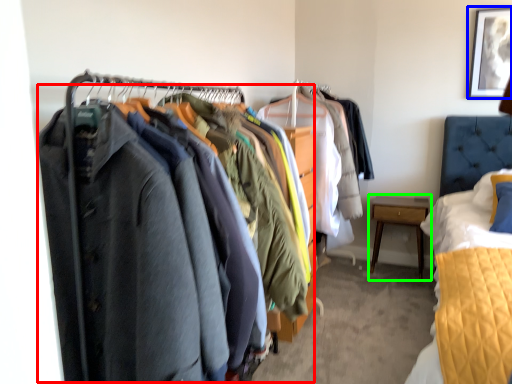
Question: Estimate the real-world distances between objects in this image. Which object is closer to closet (highlighted by a red box), picture frame (highlighted by a blue box) or nightstand (highlighted by a green box)?

Choices:
 (A) picture frame
 (B) nightstand

Answer: (B)